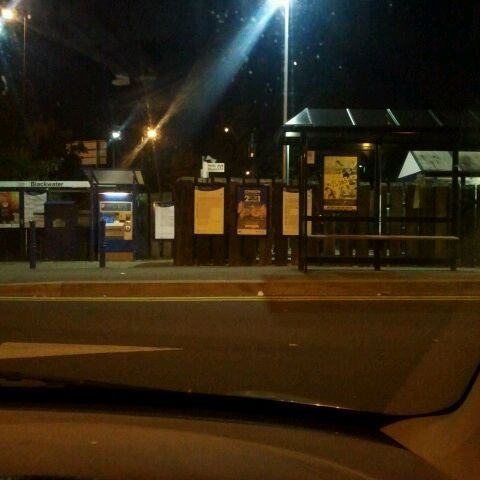
Find the location of `lights`. lights is located at coordinates (281, 3), (367, 146), (153, 133), (116, 132), (8, 9).